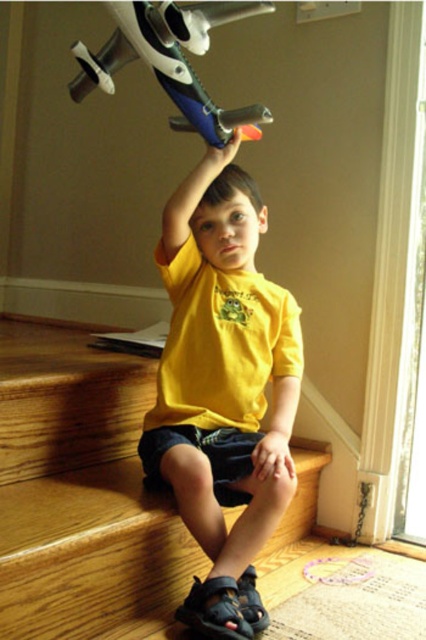
Where is the yellow matte shirt at upper center located in the image?

The yellow matte shirt at upper center is located at point (222, 387) in the image.